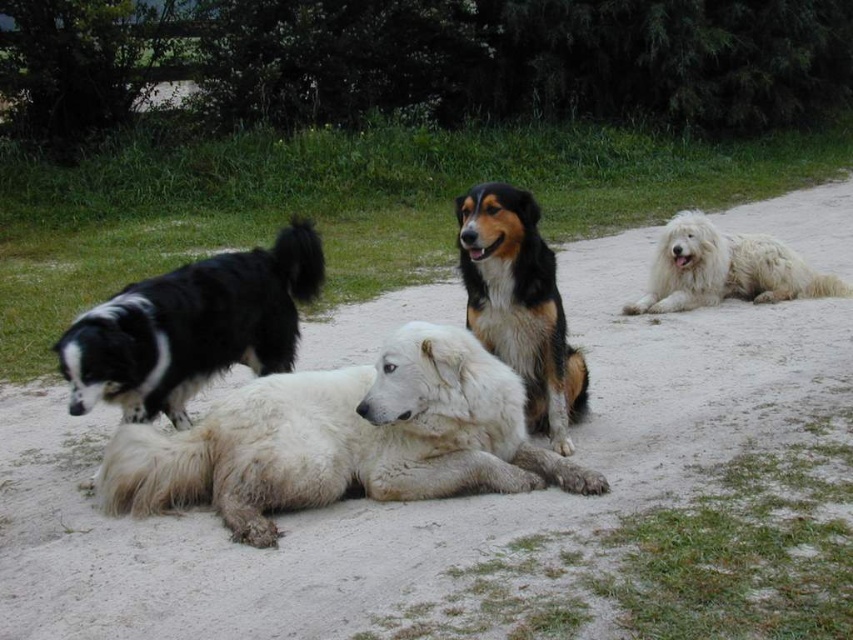
Is point (314, 237) more distant than point (495, 340)?

That is True.

Where is `black and white fur at left`? This screenshot has width=853, height=640. black and white fur at left is located at coordinates (192, 326).

This screenshot has width=853, height=640. In order to click on black and white fur at left in this screenshot , I will do `click(192, 326)`.

Is point (581, 252) positioned after point (836, 280)?

That is True.

The width and height of the screenshot is (853, 640). What are the coordinates of `white sandy path at center` in the screenshot? It's located at (405, 502).

Which is in front, point (90, 513) or point (759, 300)?

Positioned in front is point (90, 513).

Locate an element on the screen. white sandy path at center is located at coordinates (405, 502).

Does white sandy path at center have a lesser height compared to tri-colored fur dog at center?

Yes.

Which of these two, white sandy path at center or tri-colored fur dog at center, stands shorter?

white sandy path at center is shorter.

Describe the element at coordinates (405, 502) in the screenshot. I see `white sandy path at center` at that location.

The image size is (853, 640). Identify the location of white sandy path at center. (405, 502).